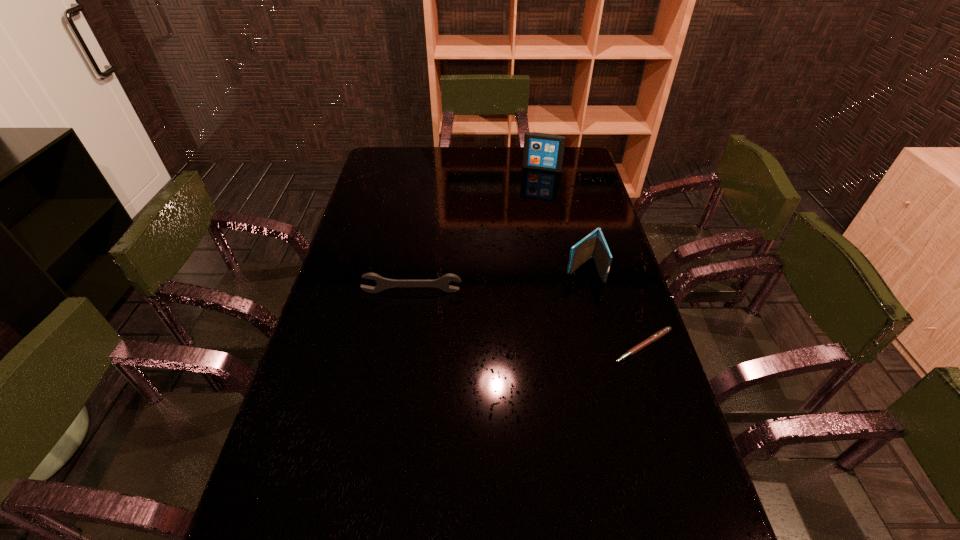
I want to click on vacant space on the desktop that is between the second shortest object and the shortest object and is positioned on the exterior surface of the third shortest object, so click(519, 317).

At what (x,y) coordinates should I click in order to perform the action: click on vacant spot on the desktop that is between the second nearest object and the shortest object and is positioned on the front screen of the farthest object. Please return your answer as a coordinate pair (x, y). This screenshot has width=960, height=540. Looking at the image, I should click on (498, 312).